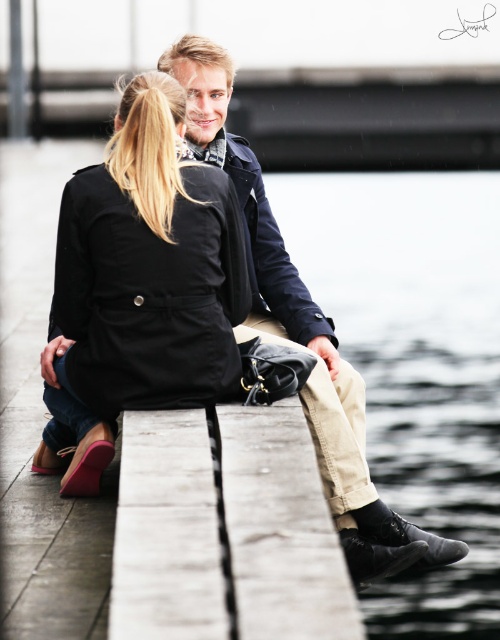
Question: Which point is closer to the camera?

Choices:
 (A) matte black coat at center
 (B) dark blue denim jacket at center

Answer: (A)

Question: Does black leather shoes at lower center appear under matte black coat at center?

Choices:
 (A) no
 (B) yes

Answer: (A)

Question: Does black leather shoes at lower center have a larger size compared to matte black coat at center?

Choices:
 (A) yes
 (B) no

Answer: (A)

Question: Which of the following is the closest to the observer?

Choices:
 (A) (x=444, y=490)
 (B) (x=195, y=333)

Answer: (B)

Question: Among these objects, which one is farthest from the camera?

Choices:
 (A) black leather shoes at lower center
 (B) dark blue denim jacket at center
 (C) matte black coat at center

Answer: (A)

Question: Does black leather shoes at lower center appear over matte black coat at center?

Choices:
 (A) no
 (B) yes

Answer: (B)